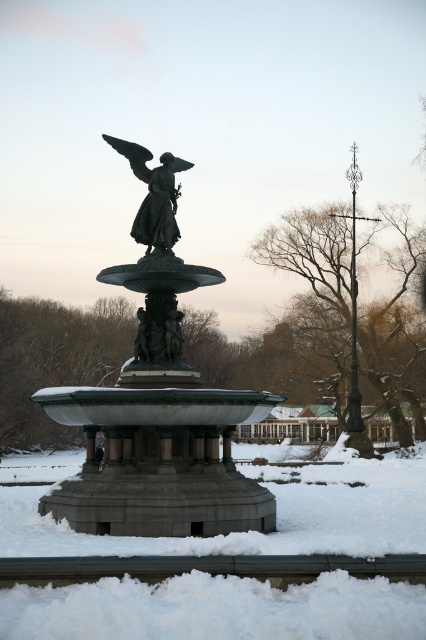
You are a photographer wanting to capture the polished bronze angel at center and the white fluffy snow at center in the same frame. Based on their positions, which object should you adjust your camera angle to focus on first if you want to include both?

The white fluffy snow at center is positioned on the right side of the polished bronze angel at center, so you should focus on the polished bronze angel at center first and then pan your camera to the right to include the white fluffy snow at center in the frame.

You are an art student analyzing the fountain sculpture. You notice two bronze elements in the scene. Which one is bigger between the bronze statue at center and the polished bronze angel at center?

The bronze statue at center is larger in size than the polished bronze angel at center.